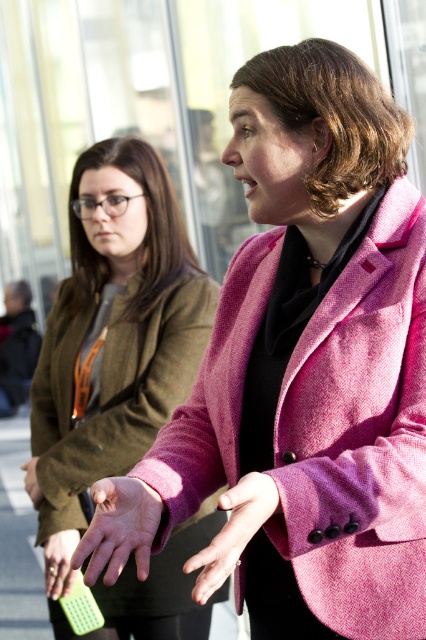
You are a photographer trying to capture a closeup of the hands in the image. The pale skin hand at center and the green fabric hand at center are overlapping. Which hand should you focus on to ensure the smaller hand is fully visible without being covered?

The pale skin hand at center is smaller than the green fabric hand at center. To ensure the smaller hand is fully visible, focus on the pale skin hand at center so it isn

In the scene shown: You are a photographer trying to capture a closeup of both hands in the scene. The pale skin hand at center and the green fabric hand at center are both in the frame. Which hand should you focus on if you want to ensure the hand that is taller in the image is in sharp focus?

The pale skin hand at center is taller than the green fabric hand at center, so focusing on the pale skin hand at center will ensure the taller hand is in sharp focus.

You are a photographer trying to capture the interaction between the two people in the image. You want to ensure that the pale skin hand at center and the green fabric hand at center are both visible in the frame. Based on their positions, which hand is positioned higher?

The pale skin hand at center is above the green fabric hand at center, so it is positioned higher.